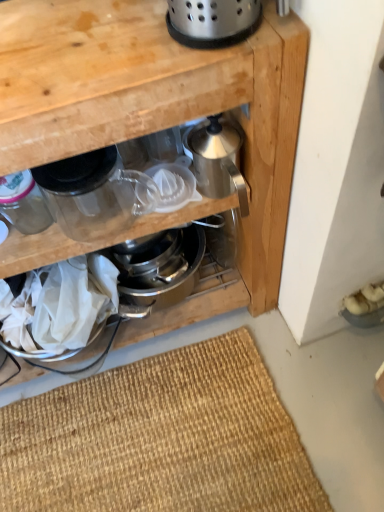
Question: From a real-world perspective, relative to polished stainless steel colander at upper center, marked as the second appliance in a right-to-left arrangement, is stainless steel kettle at center, which ranks as the 4th appliance in left-to-right order, vertically above or below?

Choices:
 (A) below
 (B) above

Answer: (A)

Question: Considering the positions of point (205, 184) and point (236, 41), is point (205, 184) closer or farther from the camera than point (236, 41)?

Choices:
 (A) farther
 (B) closer

Answer: (A)

Question: Which of these objects is positioned closest to the transparent glass jar at upper left?

Choices:
 (A) polished stainless steel colander at upper center, which ranks as the third appliance in left-to-right order
 (B) transparent glass jar at left, the first appliance viewed from the left
 (C) stainless steel kettle at center, which ranks as the 4th appliance in left-to-right order
 (D) brown woven mat at lower center
 (E) satin silver juicer at center

Answer: (B)

Question: Which object is positioned closest to the transparent plastic juicer at center, which is counted as the 3th appliance, starting from the right?

Choices:
 (A) polished stainless steel colander at upper center, marked as the second appliance in a right-to-left arrangement
 (B) stainless steel kettle at center, the 1th appliance viewed from the right
 (C) transparent glass jar at upper left
 (D) brown woven mat at lower center
 (E) transparent glass jar at left, the first appliance viewed from the left

Answer: (B)